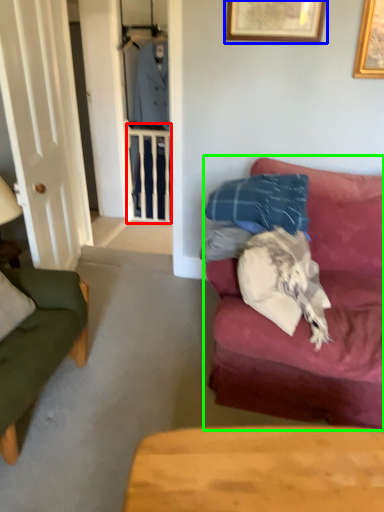
Question: Considering the real-world distances, which object is closest to balustrade (highlighted by a red box)? picture frame (highlighted by a blue box) or studio couch (highlighted by a green box).

Choices:
 (A) picture frame
 (B) studio couch

Answer: (A)